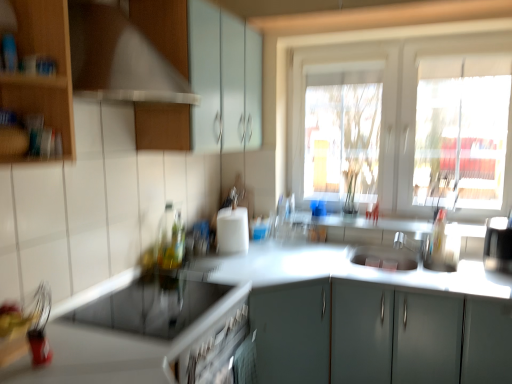
Identify the location of unoccupied space behind silver metallic faucet at center. (409, 252).